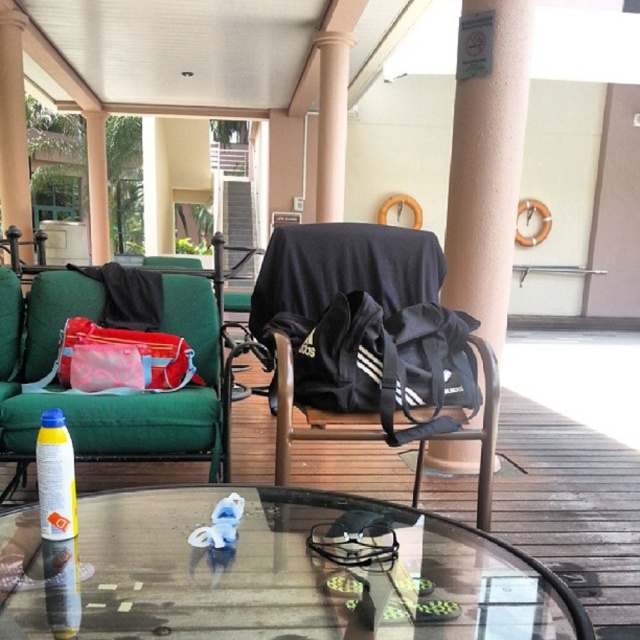
Is point (26, 205) closer to camera compared to point (52, 529)?

No, it is not.

What do you see at coordinates (13, 129) in the screenshot? Image resolution: width=640 pixels, height=640 pixels. I see `brown wood pillar at upper left` at bounding box center [13, 129].

The width and height of the screenshot is (640, 640). Find the location of `brown wood pillar at upper left`. brown wood pillar at upper left is located at coordinates (13, 129).

Locate an element on the screen. The height and width of the screenshot is (640, 640). brown wood pillar at upper left is located at coordinates (13, 129).

Is point (163, 525) positioned after point (132, 362)?

No, it is in front of (132, 362).

The width and height of the screenshot is (640, 640). Describe the element at coordinates (273, 572) in the screenshot. I see `transparent glass table at center` at that location.

What do you see at coordinates (273, 572) in the screenshot? The height and width of the screenshot is (640, 640). I see `transparent glass table at center` at bounding box center [273, 572].

Locate an element on the screen. transparent glass table at center is located at coordinates (273, 572).

Can you confirm if beige concrete pillar at center is positioned below brown wood pillar at center?

Yes.

Which is below, beige concrete pillar at center or brown wood pillar at center?

Positioned lower is beige concrete pillar at center.

Where is `beige concrete pillar at center`? beige concrete pillar at center is located at coordinates (486, 157).